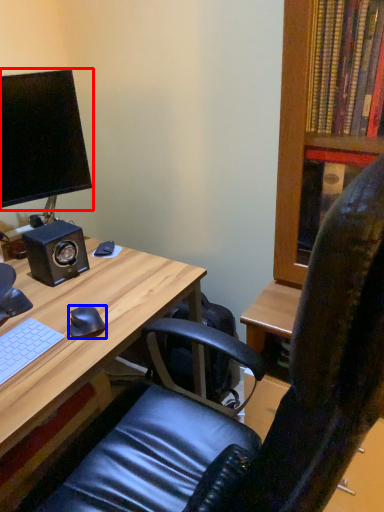
Question: Which object appears closest to the camera in this image, computer monitor (highlighted by a red box) or mouse (highlighted by a blue box)?

Choices:
 (A) computer monitor
 (B) mouse

Answer: (B)